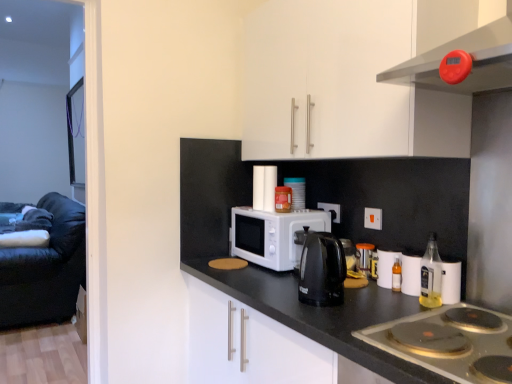
Question: From a real-world perspective, is white glossy cabinet at upper center on orange plastic electric outlet at upper center, arranged as the 1th electric outlet when viewed from the front?

Choices:
 (A) yes
 (B) no

Answer: (A)

Question: Considering the relative positions of white glossy cabinet at upper center and orange plastic electric outlet at upper center, arranged as the 1th electric outlet when viewed from the front, in the image provided, is white glossy cabinet at upper center behind orange plastic electric outlet at upper center, arranged as the 1th electric outlet when viewed from the front,?

Choices:
 (A) no
 (B) yes

Answer: (A)

Question: Is white glossy cabinet at upper center positioned beyond the bounds of orange plastic electric outlet at upper center, which is counted as the 2th electric outlet, starting from the back?

Choices:
 (A) no
 (B) yes

Answer: (B)

Question: Is orange plastic electric outlet at upper center, which is counted as the 2th electric outlet, starting from the back, at the back of white glossy cabinet at upper center?

Choices:
 (A) no
 (B) yes

Answer: (A)

Question: Considering the relative sizes of white glossy cabinet at upper center and orange plastic electric outlet at upper center, which is counted as the 2th electric outlet, starting from the back, in the image provided, is white glossy cabinet at upper center taller than orange plastic electric outlet at upper center, which is counted as the 2th electric outlet, starting from the back,?

Choices:
 (A) no
 (B) yes

Answer: (B)

Question: Is white glossy cabinet at upper center next to orange plastic electric outlet at upper center, arranged as the 1th electric outlet when viewed from the front, and touching it?

Choices:
 (A) no
 (B) yes

Answer: (A)

Question: Are translucent plastic container at center, the second appliance when ordered from right to left, and silver metallic gas stove at lower right beside each other?

Choices:
 (A) yes
 (B) no

Answer: (B)

Question: From the image's perspective, is translucent plastic container at center, placed as the 2th appliance when sorted from front to back, under silver metallic gas stove at lower right?

Choices:
 (A) no
 (B) yes

Answer: (A)

Question: Is translucent plastic container at center, acting as the 2th appliance starting from the bottom, thinner than silver metallic gas stove at lower right?

Choices:
 (A) yes
 (B) no

Answer: (A)

Question: Is translucent plastic container at center, acting as the 2th appliance starting from the bottom, completely or partially outside of silver metallic gas stove at lower right?

Choices:
 (A) yes
 (B) no

Answer: (A)

Question: From a real-world perspective, is translucent plastic container at center, acting as the first appliance starting from the back, under silver metallic gas stove at lower right?

Choices:
 (A) no
 (B) yes

Answer: (A)

Question: Does translucent plastic container at center, the second appliance when ordered from right to left, have a lesser height compared to silver metallic gas stove at lower right?

Choices:
 (A) yes
 (B) no

Answer: (B)

Question: Does white plastic electric outlet at center, which is counted as the 2th electric outlet, starting from the front, have a greater height compared to translucent glass bottle at right?

Choices:
 (A) no
 (B) yes

Answer: (A)